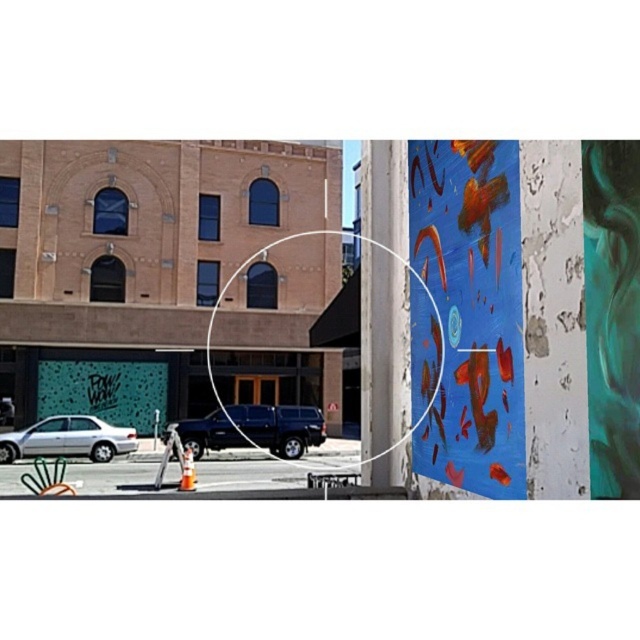
Does blue painted canvas at right come in front of shiny black suv at center?

That is True.

Can you confirm if blue painted canvas at right is wider than shiny black suv at center?

No.

Which is in front, point (518, 376) or point (225, 419)?

Point (518, 376)

Identify the location of blue painted canvas at right. (472, 310).

Is shiny black suv at center further to camera compared to silver metallic car at lower left?

Yes, shiny black suv at center is behind silver metallic car at lower left.

Is shiny black suv at center to the left of silver metallic car at lower left from the viewer's perspective?

No, shiny black suv at center is not to the left of silver metallic car at lower left.

Is point (188, 428) in front of point (81, 428)?

Yes, point (188, 428) is closer to viewer.

Where is `shiny black suv at center`? The image size is (640, 640). shiny black suv at center is located at coordinates (280, 426).

Can you confirm if blue painted canvas at right is thinner than silver metallic car at lower left?

Yes.

Which of these two, blue painted canvas at right or silver metallic car at lower left, stands shorter?

silver metallic car at lower left is shorter.

Is point (497, 292) less distant than point (38, 420)?

Yes, point (497, 292) is in front of point (38, 420).

I want to click on blue painted canvas at right, so click(472, 310).